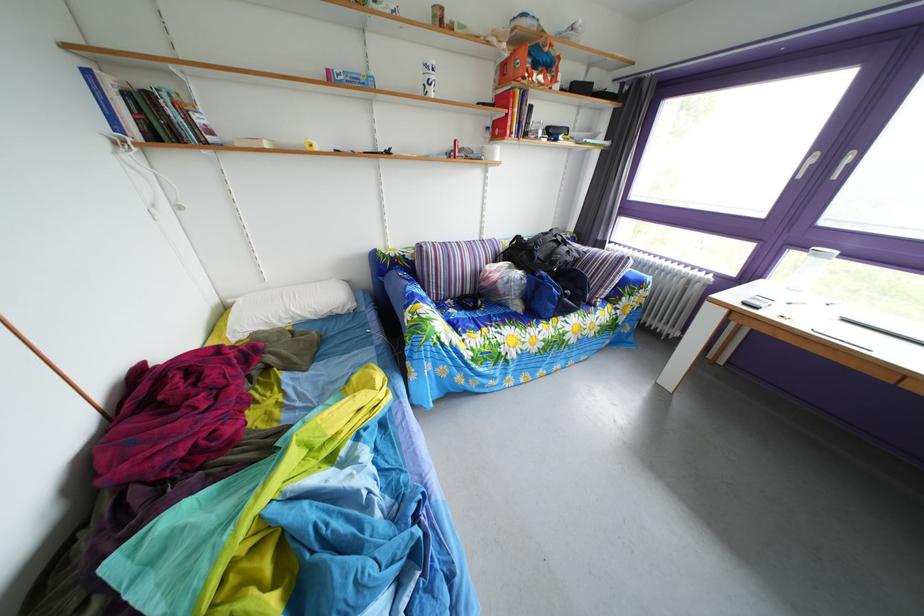
Image resolution: width=924 pixels, height=616 pixels. I want to click on white bed pillow, so click(287, 306).